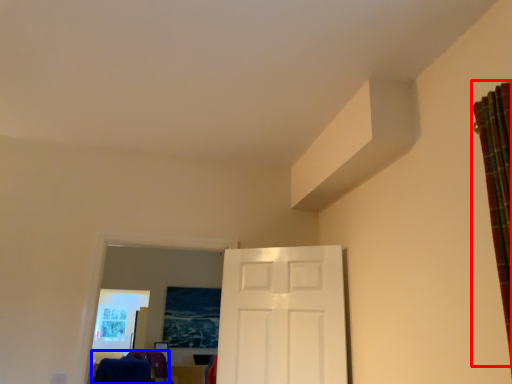
Question: Which of the following is the closest to the observer, curtain (highlighted by a red box) or laundry (highlighted by a blue box)?

Choices:
 (A) curtain
 (B) laundry

Answer: (A)